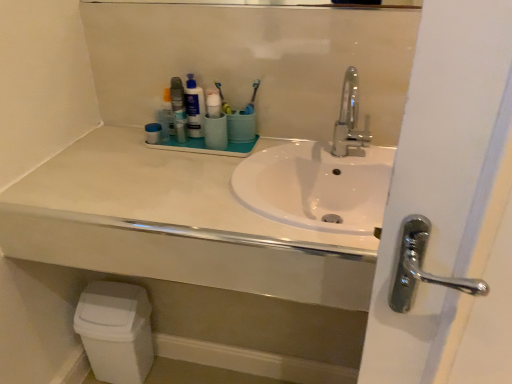
You are a GUI agent. You are given a task and a screenshot of the screen. Output one action in this format:
    pyautogui.click(x=<x>, y=<y>)
    Task: Click on the vacant space in front of matte plastic mouthwash at center
    
    Given the screenshot: What is the action you would take?
    pyautogui.click(x=170, y=160)